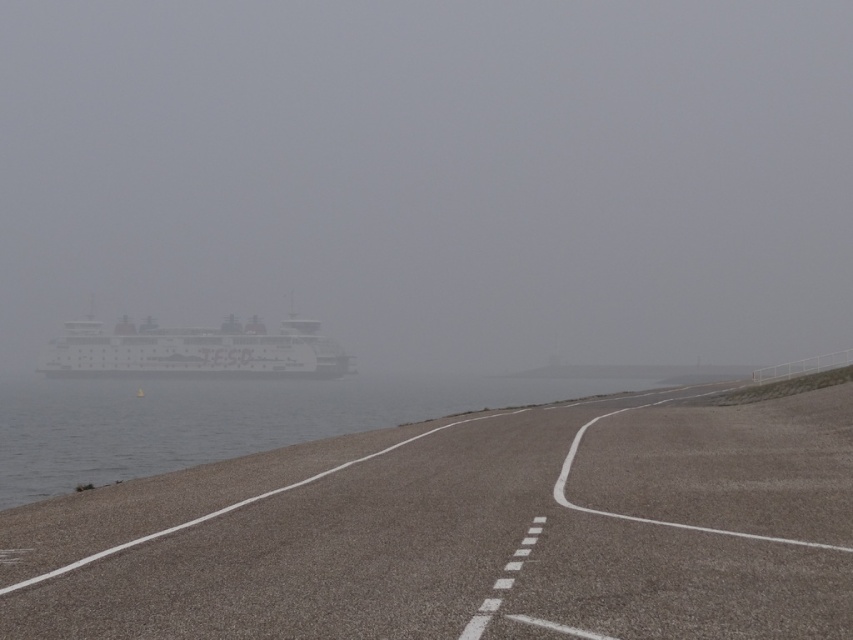
Is foggy white ship at center to the left of gray asphalt shoreline at lower left from the viewer's perspective?

Yes, foggy white ship at center is to the left of gray asphalt shoreline at lower left.

Is point (587, 300) behind point (659, 445)?

Yes, it is.

Between point (599, 275) and point (749, 579), which one is positioned behind?

Point (599, 275)

Locate an element on the screen. This screenshot has height=640, width=853. foggy white ship at center is located at coordinates (434, 173).

Is gray asphalt shoreline at lower left to the right of clear water at left from the viewer's perspective?

Yes, gray asphalt shoreline at lower left is to the right of clear water at left.

Can you confirm if gray asphalt shoreline at lower left is thinner than clear water at left?

Yes, gray asphalt shoreline at lower left is thinner than clear water at left.

Where is `gray asphalt shoreline at lower left`? The height and width of the screenshot is (640, 853). gray asphalt shoreline at lower left is located at coordinates (468, 531).

Is clear water at left bigger than white matte ship at left?

Yes, clear water at left is bigger than white matte ship at left.

Where is `clear water at left`? clear water at left is located at coordinates (223, 419).

Does point (57, 442) come behind point (279, 364)?

That is False.

Where is `clear water at left`? Image resolution: width=853 pixels, height=640 pixels. clear water at left is located at coordinates (223, 419).